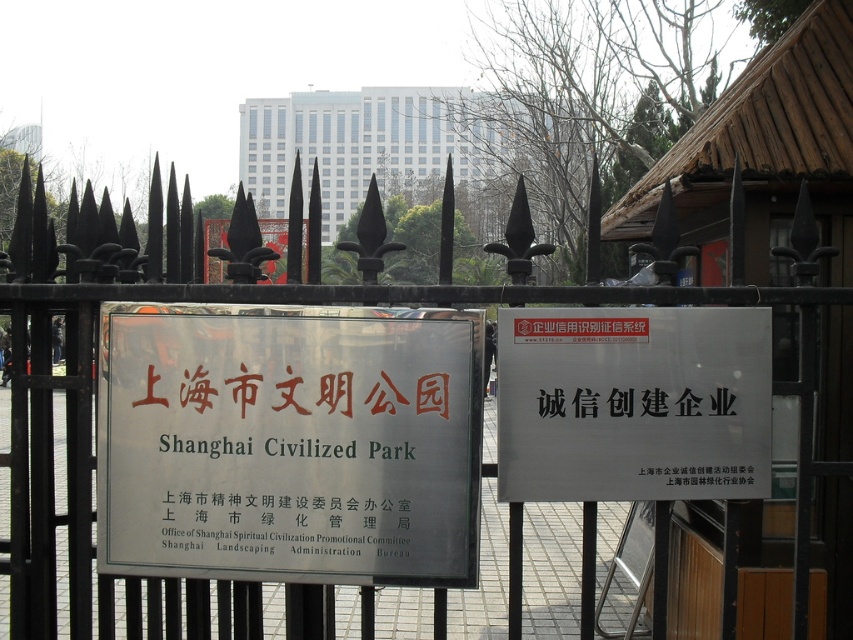
Question: Observing the image, what is the correct spatial positioning of wooden hut at center in reference to black paper sign at center?

Choices:
 (A) right
 (B) left

Answer: (A)

Question: Among these points, which one is nearest to the camera?

Choices:
 (A) [122, 506]
 (B) [506, 346]

Answer: (B)

Question: Which is farther from the black metallic sign at center?

Choices:
 (A) black paper sign at center
 (B) white plastic sign at center

Answer: (B)

Question: Which object is closer to the camera taking this photo?

Choices:
 (A) black metallic sign at center
 (B) white matte sign at center
 (C) wooden hut at center
 (D) white glass building at upper center

Answer: (B)

Question: Can you confirm if wooden hut at center is bigger than black paper sign at center?

Choices:
 (A) no
 (B) yes

Answer: (B)

Question: Can you confirm if white glass building at upper center is positioned to the right of black paper sign at center?

Choices:
 (A) no
 (B) yes

Answer: (A)